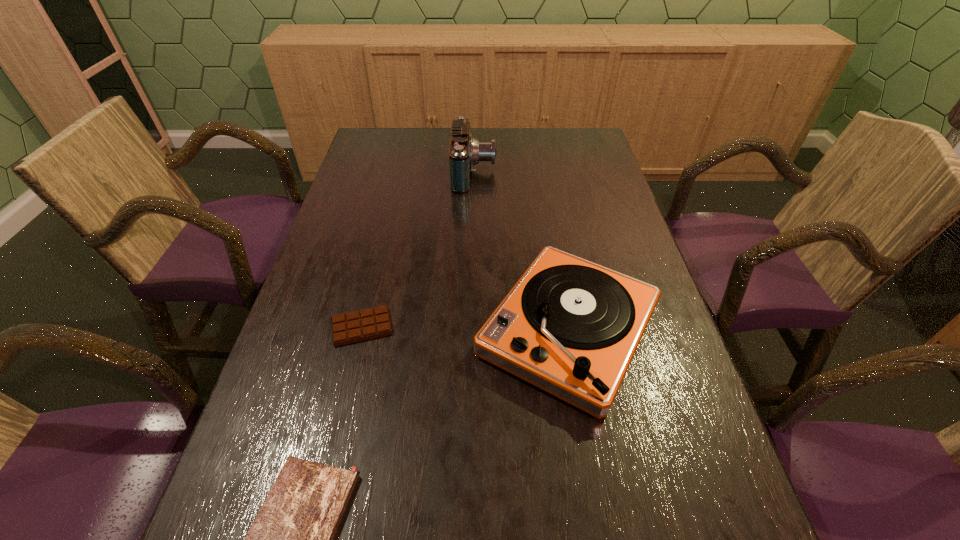
Where is `the second closest object relative to the second tallest object`? The height and width of the screenshot is (540, 960). the second closest object relative to the second tallest object is located at coordinates point(291,539).

Where is `object that can be found as the third closest to the nearest object`? Image resolution: width=960 pixels, height=540 pixels. object that can be found as the third closest to the nearest object is located at coordinates (464, 152).

What are the coordinates of `free location that satisfies the following two spatial constraints: 1. on the front-facing side of the camcorder; 2. on the front side of the candy bar` in the screenshot? It's located at (471, 327).

At what (x,y) coordinates should I click in order to perform the action: click on free spot that satisfies the following two spatial constraints: 1. on the front-facing side of the second tallest object; 2. on the left side of the tallest object. Please return your answer as a coordinate pair (x, y). The width and height of the screenshot is (960, 540). Looking at the image, I should click on (471, 330).

You are a GUI agent. You are given a task and a screenshot of the screen. Output one action in this format:
    pyautogui.click(x=<x>, y=<y>)
    Task: Click on the free space that satisfies the following two spatial constraints: 1. on the front side of the candy bar; 2. on the left side of the third shortest object
    The width and height of the screenshot is (960, 540).
    Given the screenshot: What is the action you would take?
    pyautogui.click(x=361, y=330)

Find the location of a particular element. free space that satisfies the following two spatial constraints: 1. on the front side of the candy bar; 2. on the right side of the third shortest object is located at coordinates (361, 330).

The width and height of the screenshot is (960, 540). I want to click on free space that satisfies the following two spatial constraints: 1. on the front-facing side of the camcorder; 2. on the back side of the record player, so (x=471, y=330).